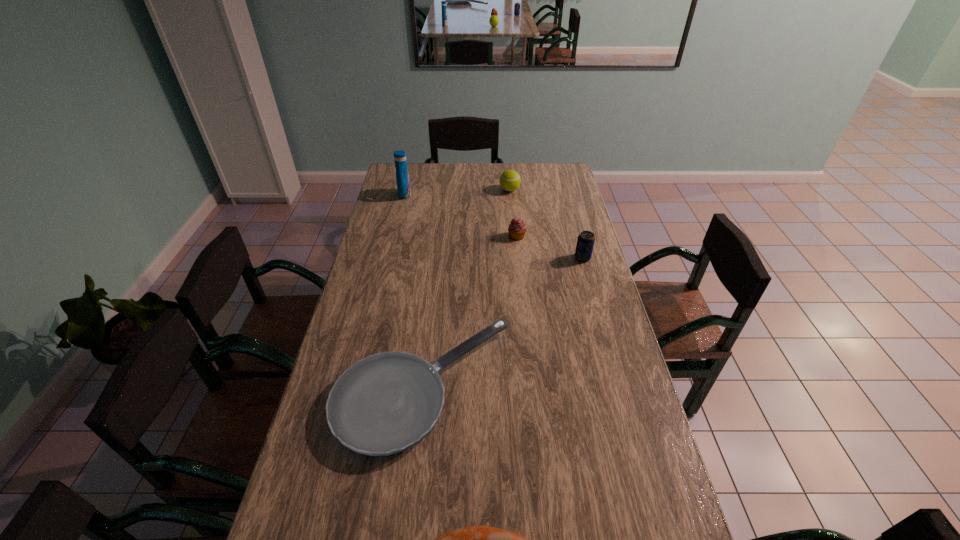
In order to click on free spot that satisfies the following two spatial constraints: 1. on the front-facing side of the detergent; 2. on the right side of the soda in this screenshot , I will do `click(390, 258)`.

Locate an element on the screen. vacant position in the image that satisfies the following two spatial constraints: 1. on the front-facing side of the detergent; 2. on the left side of the cupcake is located at coordinates (395, 237).

Locate an element on the screen. The width and height of the screenshot is (960, 540). free spot that satisfies the following two spatial constraints: 1. on the front side of the soda; 2. on the right side of the cupcake is located at coordinates (519, 258).

I want to click on vacant space that satisfies the following two spatial constraints: 1. on the front-facing side of the tallest object; 2. on the back side of the rightmost object, so click(x=390, y=258).

The image size is (960, 540). Find the location of `vacant space that satisfies the following two spatial constraints: 1. on the back side of the third nearest object; 2. on the front-facing side of the tallest object`. vacant space that satisfies the following two spatial constraints: 1. on the back side of the third nearest object; 2. on the front-facing side of the tallest object is located at coordinates (565, 194).